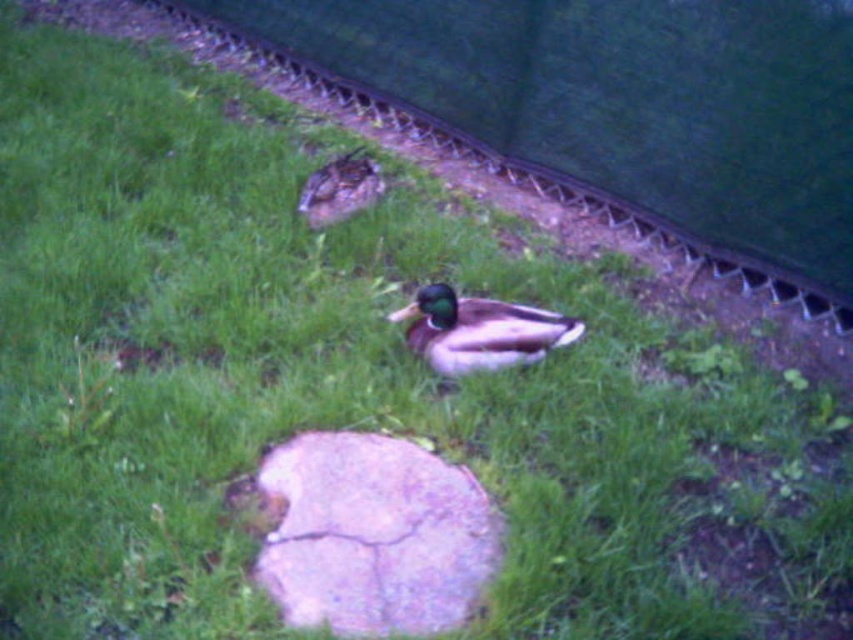
You are standing at the origin point of the image coordinate system, which is the bottom left corner. You want to locate the purple cracked rock at center. What are its coordinates?

The purple cracked rock at center is located at coordinates 0.838 on the x axis and 0.440 on the y axis.

You are a photographer trying to capture a clear shot of the green matte duck at center. However, there is a purple cracked rock at center in the way. Can you still take a photo of the duck without the rock blocking it, considering their heights?

The purple cracked rock at center is taller than the green matte duck at center, so the rock will block the view of the duck, making it impossible to take a clear photo without the rock obstructing it.